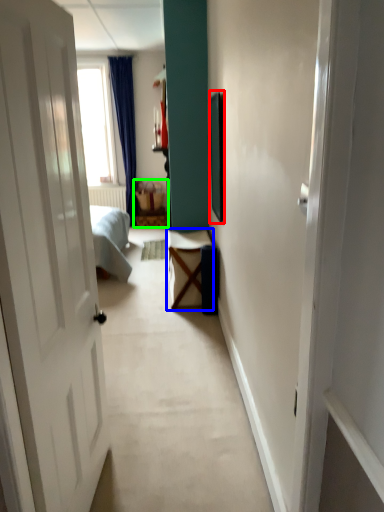
Question: Which object is the farthest from picture frame (highlighted by a red box)? Choose among these: table (highlighted by a blue box) or furniture (highlighted by a green box).

Choices:
 (A) table
 (B) furniture

Answer: (B)